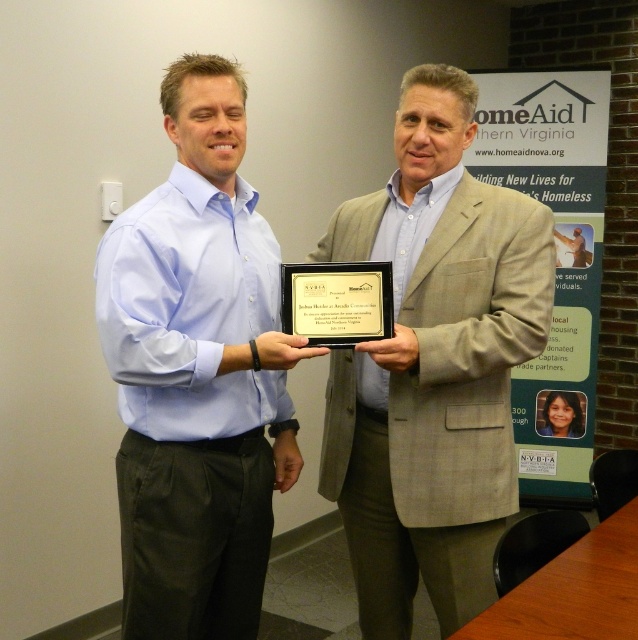
Measure the distance between light brown textured blazer at center and camera.

The distance of light brown textured blazer at center from camera is 5.07 feet.

Can you confirm if light brown textured blazer at center is taller than black plastic plaque at center?

Yes, light brown textured blazer at center is taller than black plastic plaque at center.

Is point (403, 156) closer to camera compared to point (375, 337)?

No.

The width and height of the screenshot is (638, 640). Identify the location of light brown textured blazer at center. (433, 365).

Which is above, light brown textured blazer at center or light blue shirt at center?

light blue shirt at center

Does point (330, 388) come farther from viewer compared to point (167, 508)?

Yes.

Is point (443, 292) more distant than point (258, 220)?

No, (443, 292) is closer to viewer.

Identify the location of light brown textured blazer at center. This screenshot has width=638, height=640. (433, 365).

Measure the distance between light blue shirt at center and camera.

1.42 meters

Can you confirm if light blue shirt at center is taller than black plastic plaque at center?

Indeed, light blue shirt at center has a greater height compared to black plastic plaque at center.

Is point (163, 273) closer to camera compared to point (359, 321)?

Yes, it is.

I want to click on light blue shirt at center, so click(197, 372).